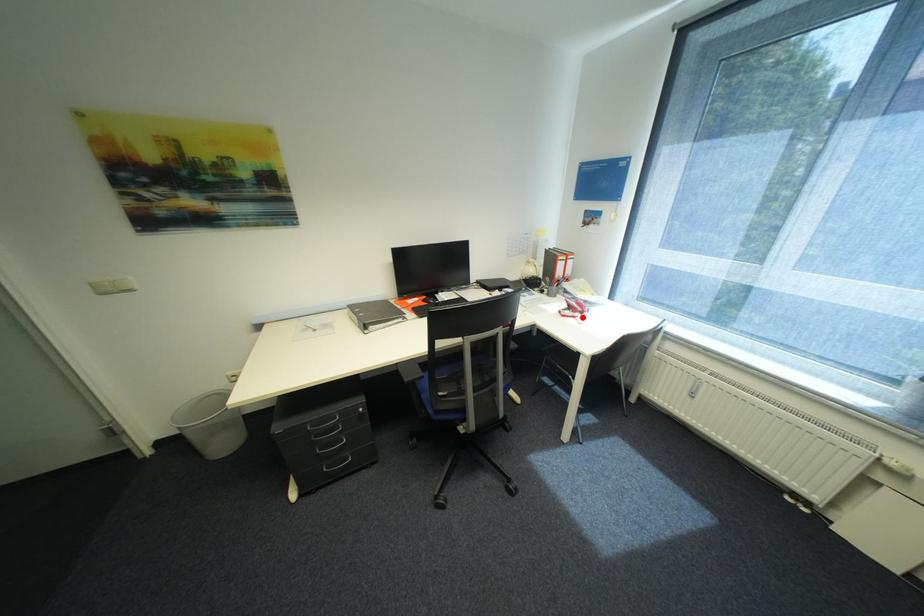
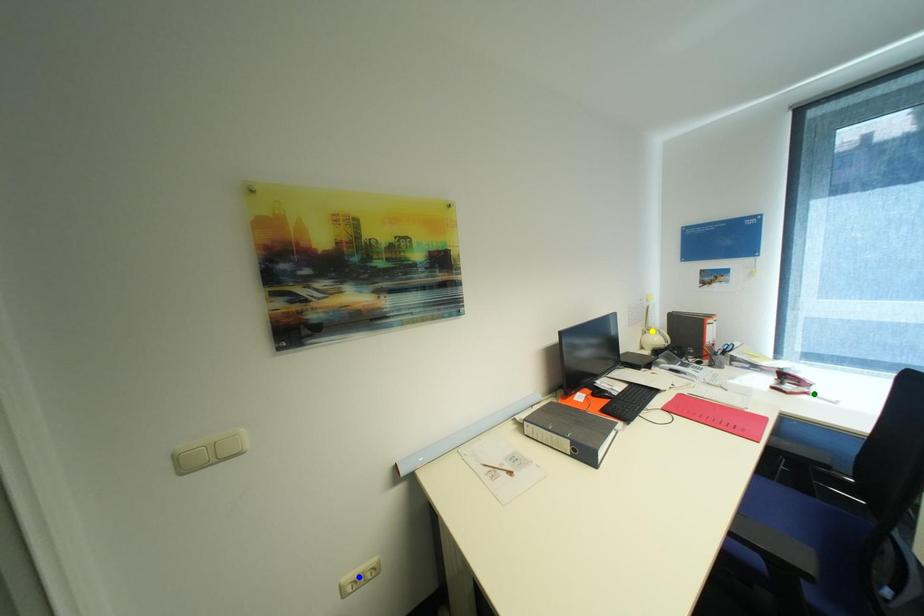
Question: I am providing you with two images of the same scene from different viewpoints. A red point is marked on the first image. You are given multiple points on the second image. In image 2, which mark is for the same physical point as the one in image 1?

Choices:
 (A) blue point
 (B) green point
 (C) yellow point

Answer: (B)